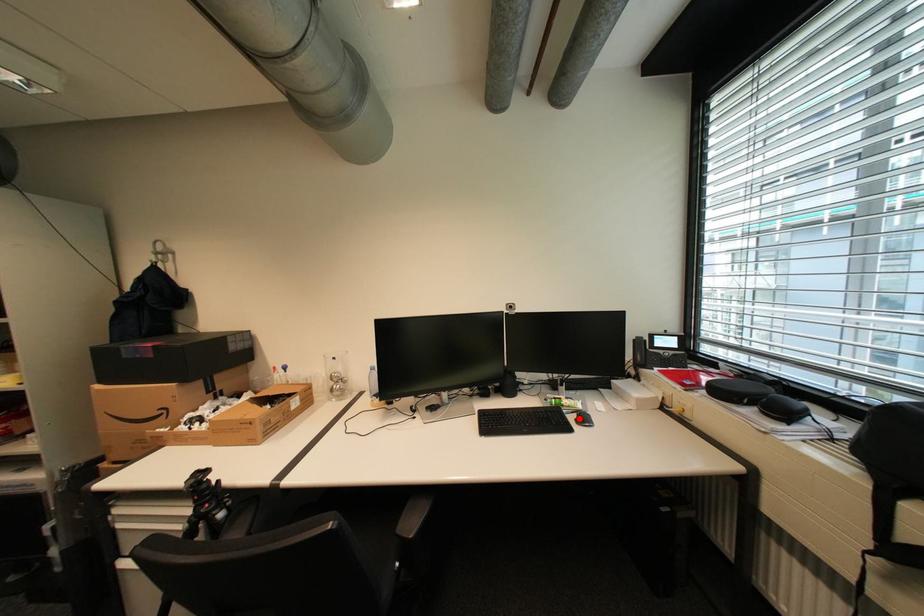
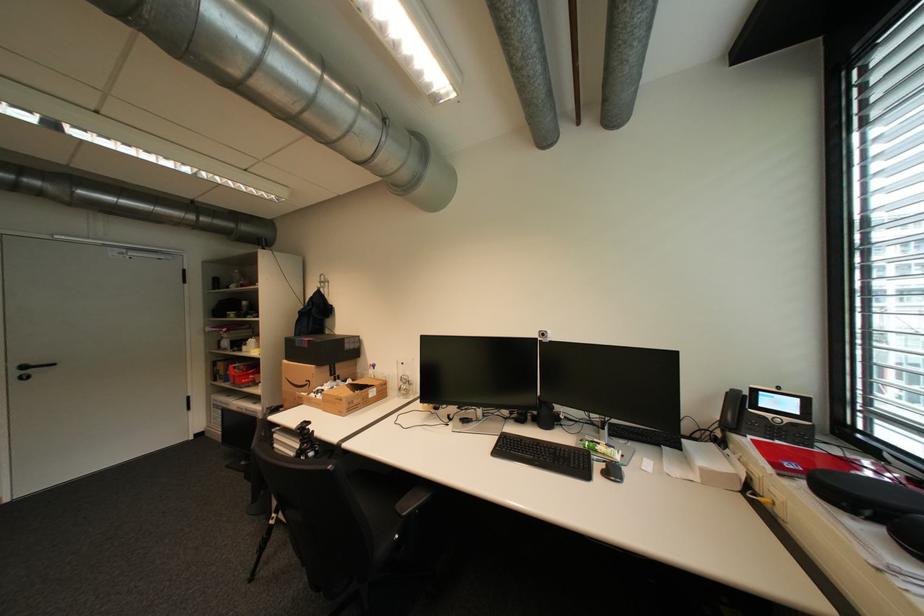
Where in the second image is the point corresponding to the highlighted location from the first image?

(606, 467)